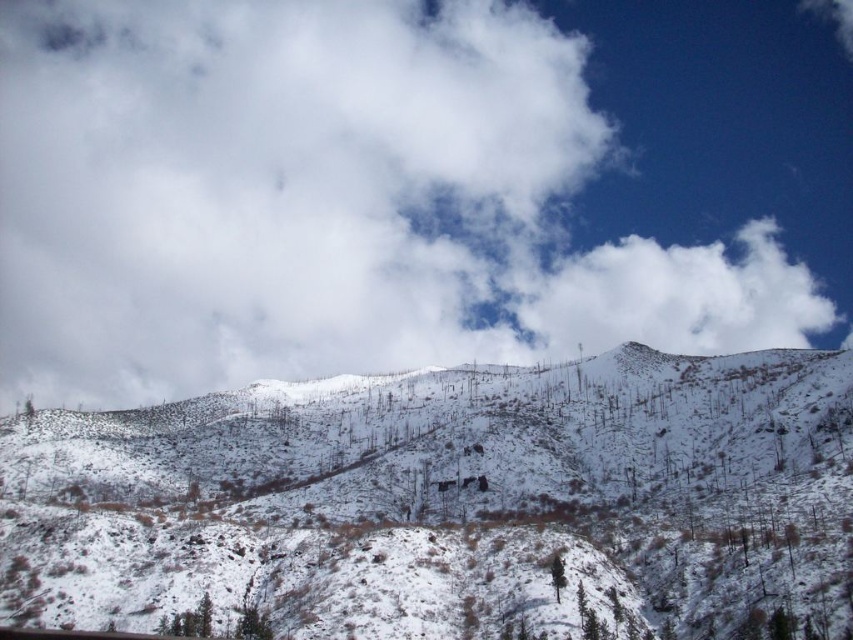
Is white snow-covered hillside at center taller than white fluffy cloud at upper right?

In fact, white snow-covered hillside at center may be shorter than white fluffy cloud at upper right.

Identify the location of white snow-covered hillside at center. The image size is (853, 640). (450, 502).

Does point (346, 429) come closer to viewer compared to point (753, 259)?

Yes, point (346, 429) is closer to viewer.

You are a GUI agent. You are given a task and a screenshot of the screen. Output one action in this format:
    pyautogui.click(x=<x>, y=<y>)
    Task: Click on the white snow-covered hillside at center
    This screenshot has height=640, width=853.
    Given the screenshot: What is the action you would take?
    pyautogui.click(x=450, y=502)

From the picture: Between white fluffy cloud at upper center and white fluffy cloud at upper right, which one is positioned lower?

white fluffy cloud at upper right is lower down.

Does white fluffy cloud at upper center have a larger size compared to white fluffy cloud at upper right?

Yes, white fluffy cloud at upper center is bigger than white fluffy cloud at upper right.

Is point (643, 136) closer to camera compared to point (737, 280)?

That is True.

The image size is (853, 640). What are the coordinates of `white fluffy cloud at upper center` in the screenshot? It's located at (410, 186).

Between white fluffy cloud at upper center and white snow-covered hillside at center, which one is positioned lower?

white snow-covered hillside at center

Who is shorter, white fluffy cloud at upper center or white snow-covered hillside at center?

With less height is white snow-covered hillside at center.

Is point (328, 163) farther from viewer compared to point (131, 417)?

Yes.

Locate an element on the screen. The height and width of the screenshot is (640, 853). white fluffy cloud at upper center is located at coordinates (410, 186).